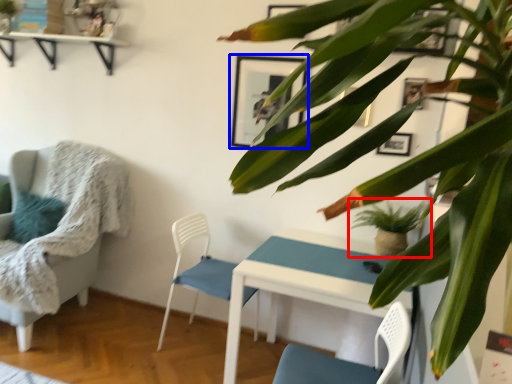
Question: Which object appears farthest to the camera in this image, houseplant (highlighted by a red box) or picture frame (highlighted by a blue box)?

Choices:
 (A) houseplant
 (B) picture frame

Answer: (B)